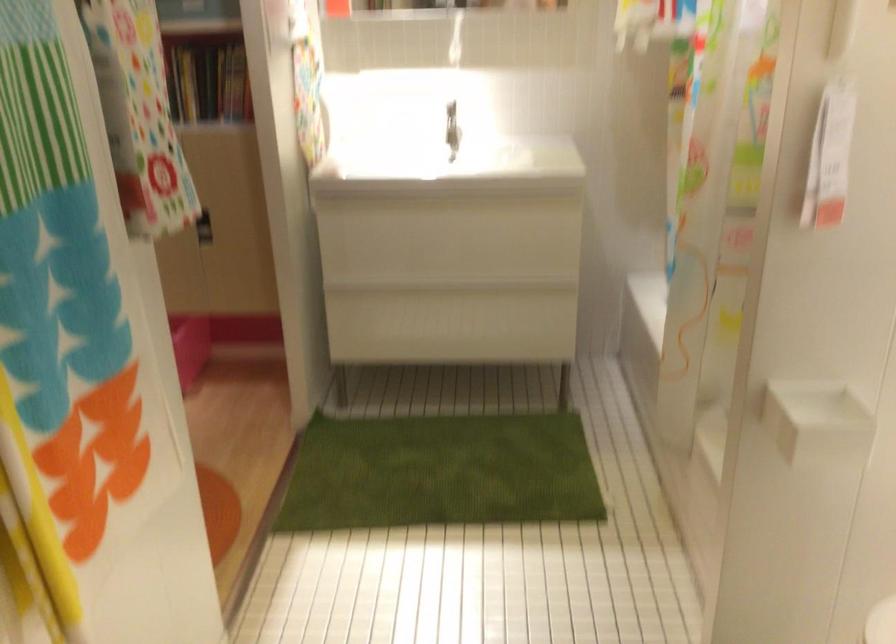
Where would you lift the faucet handle? Please return your answer as a coordinate pair (x, y).

(452, 126)